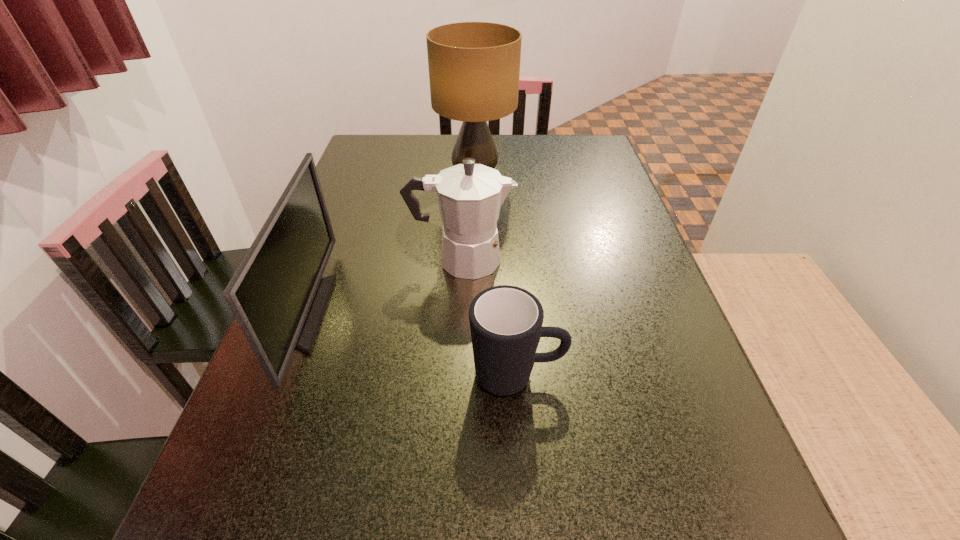
At what (x,y) coordinates should I click in order to perform the action: click on object that is at the left edge. Please return your answer as a coordinate pair (x, y). This screenshot has height=540, width=960. Looking at the image, I should click on (277, 295).

Find the location of `vacant space at the far edge of the desktop`. vacant space at the far edge of the desktop is located at coordinates (527, 139).

Find the location of a particular element. vacant space at the left edge of the desktop is located at coordinates (361, 178).

Identify the location of vacant space at the right edge. This screenshot has height=540, width=960. (623, 267).

In the image, there is a desktop. Where is `free space at the far right corner`? Image resolution: width=960 pixels, height=540 pixels. free space at the far right corner is located at coordinates (597, 140).

Find the location of `vacant area that lies between the farthest object and the monitor`. vacant area that lies between the farthest object and the monitor is located at coordinates (390, 245).

I want to click on free area in between the mug and the leftmost object, so click(411, 344).

Locate an element on the screen. The width and height of the screenshot is (960, 540). free spot between the tallest object and the leftmost object is located at coordinates (390, 245).

The height and width of the screenshot is (540, 960). I want to click on blank region between the leftmost object and the coffeepot, so click(383, 286).

Identify the location of free space between the shortest object and the monitor. Image resolution: width=960 pixels, height=540 pixels. (411, 344).